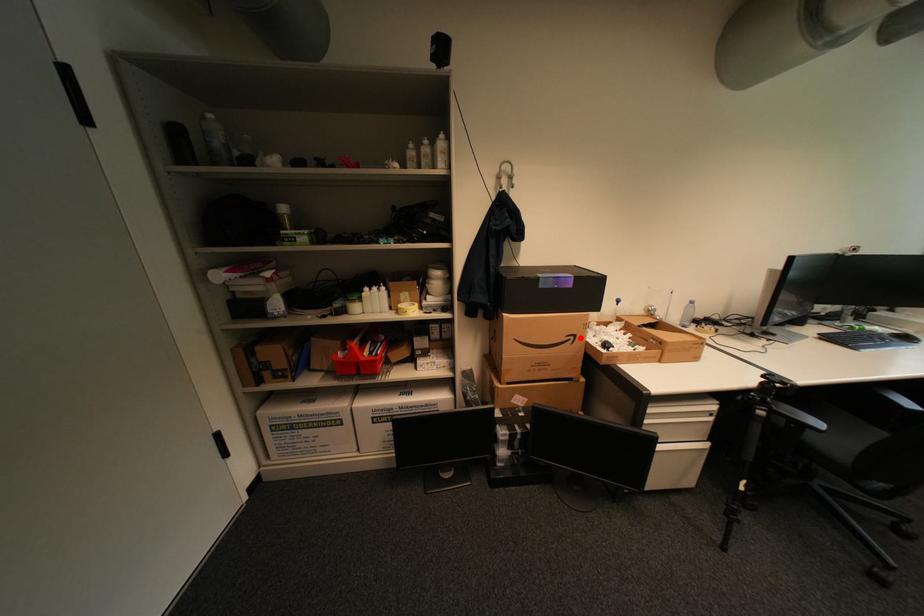
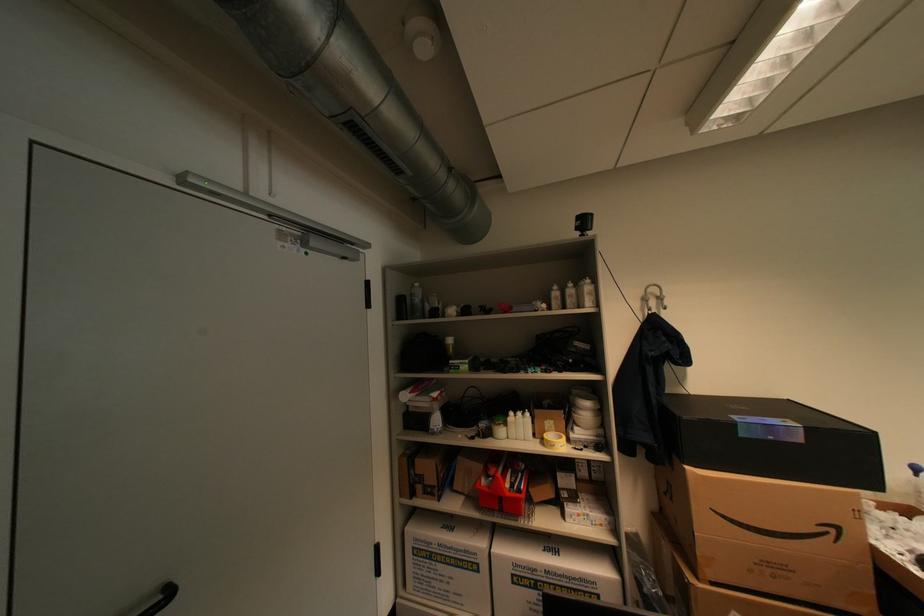
Question: I am providing you with two images of the same scene from different viewpoints. In image1, a red point is highlighted. Considering the same 3D point in image2, which of the following is correct?

Choices:
 (A) It is closer
 (B) It is farther

Answer: (A)